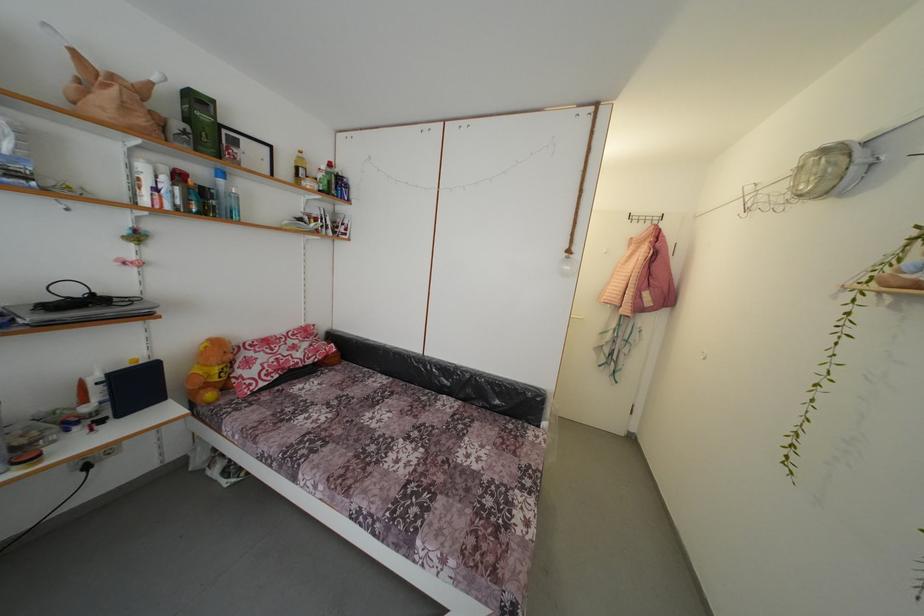
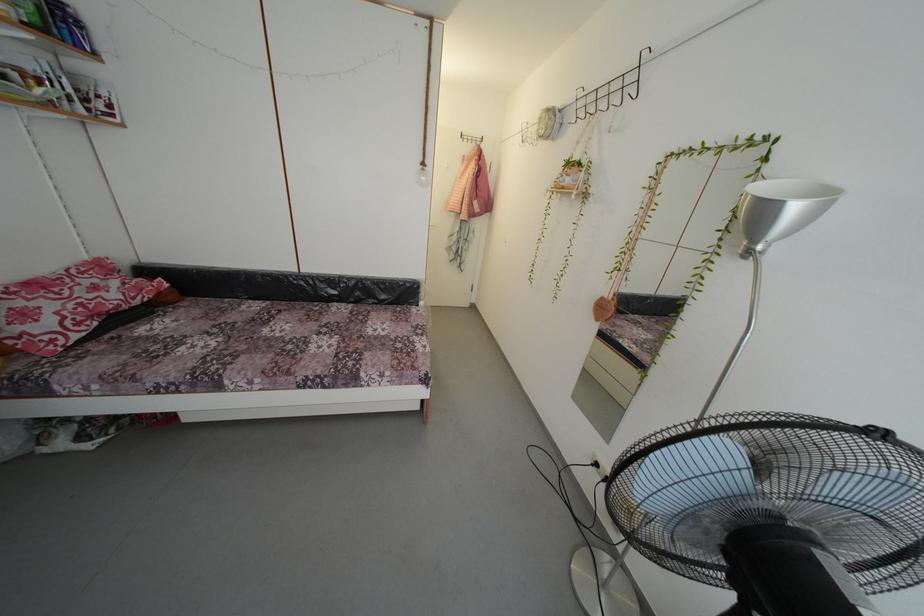
Question: I am providing you with two images of the same scene from different viewpoints. After the viewpoint changes to image2, which objects are now occluded?

Choices:
 (A) black wall hook
 (B) hanging lightbulb
 (C) silver lamp head
 (D) none of these

Answer: (D)